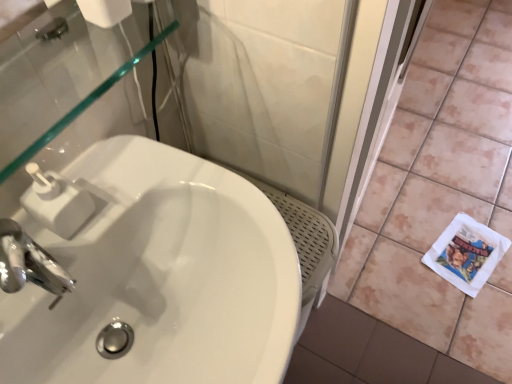
Question: Would you consider white plastic soap dispenser at upper left to be distant from white glossy sink at center?

Choices:
 (A) no
 (B) yes

Answer: (A)

Question: Is white plastic soap dispenser at upper left not within white glossy sink at center?

Choices:
 (A) yes
 (B) no

Answer: (A)

Question: Can you confirm if white plastic soap dispenser at upper left is shorter than white glossy sink at center?

Choices:
 (A) yes
 (B) no

Answer: (A)

Question: Does white plastic soap dispenser at upper left have a smaller size compared to white glossy sink at center?

Choices:
 (A) no
 (B) yes

Answer: (B)

Question: Is the depth of white plastic soap dispenser at upper left greater than that of white glossy sink at center?

Choices:
 (A) yes
 (B) no

Answer: (A)

Question: Is white plastic soap dispenser at upper left turned away from white glossy sink at center?

Choices:
 (A) yes
 (B) no

Answer: (B)

Question: From a real-world perspective, does white plastic soap dispenser at upper left stand above white ceramic tile at lower right?

Choices:
 (A) yes
 (B) no

Answer: (A)

Question: Is white plastic soap dispenser at upper left aimed at white ceramic tile at lower right?

Choices:
 (A) yes
 (B) no

Answer: (B)

Question: Does white plastic soap dispenser at upper left appear on the left side of white ceramic tile at lower right?

Choices:
 (A) no
 (B) yes

Answer: (B)

Question: Does white plastic soap dispenser at upper left have a smaller size compared to white ceramic tile at lower right?

Choices:
 (A) yes
 (B) no

Answer: (A)

Question: Considering the relative sizes of white plastic soap dispenser at upper left and white ceramic tile at lower right in the image provided, is white plastic soap dispenser at upper left thinner than white ceramic tile at lower right?

Choices:
 (A) no
 (B) yes

Answer: (B)

Question: Is the position of white plastic soap dispenser at upper left more distant than that of white ceramic tile at lower right?

Choices:
 (A) no
 (B) yes

Answer: (A)

Question: Is white matte toilet paper at upper left positioned far away from white ceramic tile at lower right?

Choices:
 (A) yes
 (B) no

Answer: (A)